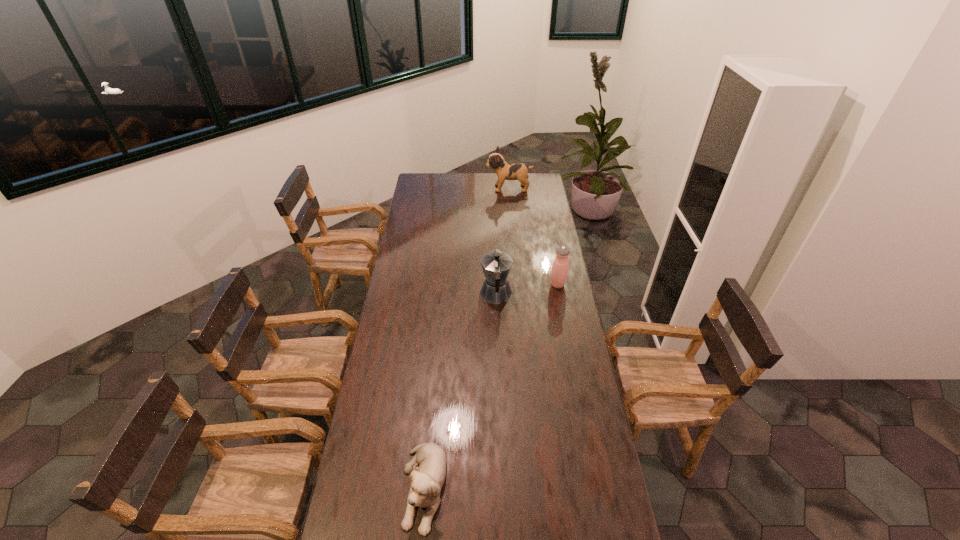
The height and width of the screenshot is (540, 960). In the image, there is a desktop. Find the location of `vacant space at the far left corner`. vacant space at the far left corner is located at coordinates (425, 179).

Identify the location of blank area at the far right corner. The height and width of the screenshot is (540, 960). (542, 182).

Where is `free space between the rightmost object and the coffeepot`? free space between the rightmost object and the coffeepot is located at coordinates (527, 289).

Find the location of a particular element. blank region between the coffeepot and the shortest object is located at coordinates (460, 391).

Find the location of a particular element. The image size is (960, 540). free spot between the coffeepot and the farther puppy is located at coordinates (502, 241).

Where is `free space between the rightmost object and the coffeepot`? free space between the rightmost object and the coffeepot is located at coordinates (527, 289).

Find the location of a particular element. free space that is in between the farther puppy and the thermos bottle is located at coordinates (533, 237).

I want to click on vacant region between the thermos bottle and the farthest object, so click(x=533, y=237).

I want to click on blank region between the shortest object and the farthest object, so click(x=467, y=338).

The image size is (960, 540). What are the coordinates of `vacant point located between the shortest object and the rightmost object` in the screenshot? It's located at [x=491, y=386].